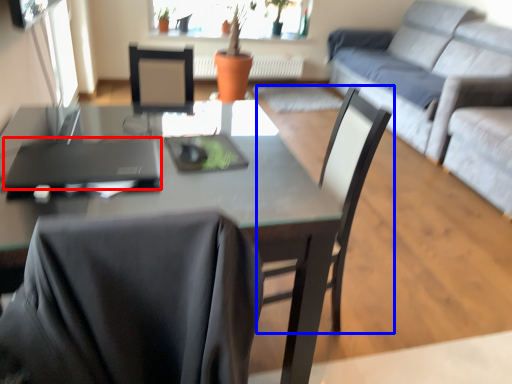
Question: Among these objects, which one is farthest to the camera, laptop (highlighted by a red box) or chair (highlighted by a blue box)?

Choices:
 (A) laptop
 (B) chair

Answer: (B)